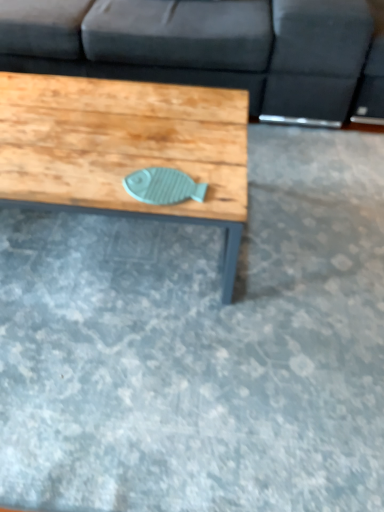
In order to face dark gray fabric couch at upper center, should I rotate leftwards or rightwards?

Rotate left and turn 5.666 degrees.

The height and width of the screenshot is (512, 384). I want to click on dark gray fabric couch at upper center, so click(x=213, y=50).

Measure the distance between point (208, 72) and camera.

Point (208, 72) and camera are 1.80 meters apart from each other.

The width and height of the screenshot is (384, 512). Describe the element at coordinates (213, 50) in the screenshot. I see `dark gray fabric couch at upper center` at that location.

This screenshot has height=512, width=384. What do you see at coordinates (124, 147) in the screenshot?
I see `wooden fish at center` at bounding box center [124, 147].

Locate an element on the screen. The height and width of the screenshot is (512, 384). wooden fish at center is located at coordinates (124, 147).

Image resolution: width=384 pixels, height=512 pixels. I want to click on dark gray fabric couch at upper center, so [213, 50].

Is dark gray fabric couch at upper center at the left side of wooden fish at center?

In fact, dark gray fabric couch at upper center is to the right of wooden fish at center.

Does dark gray fabric couch at upper center come behind wooden fish at center?

That is True.

Between point (373, 106) and point (64, 85), which one is positioned in front?

The point (64, 85) is in front.

From the image's perspective, between dark gray fabric couch at upper center and wooden fish at center, who is located below?

wooden fish at center appears lower in the image.

From a real-world perspective, between dark gray fabric couch at upper center and wooden fish at center, who is vertically higher?

dark gray fabric couch at upper center is physically above.

Looking at this image, considering the relative sizes of dark gray fabric couch at upper center and wooden fish at center in the image provided, is dark gray fabric couch at upper center wider than wooden fish at center?

Yes.

Consider the image. In terms of height, does dark gray fabric couch at upper center look taller or shorter compared to wooden fish at center?

dark gray fabric couch at upper center is taller than wooden fish at center.

Between dark gray fabric couch at upper center and wooden fish at center, which one has smaller size?

With smaller size is wooden fish at center.

Would you say dark gray fabric couch at upper center is inside or outside wooden fish at center?

dark gray fabric couch at upper center is outside wooden fish at center.

Is there a large distance between dark gray fabric couch at upper center and wooden fish at center?

No, there isn't a large distance between dark gray fabric couch at upper center and wooden fish at center.

Is wooden fish at center at the back of dark gray fabric couch at upper center?

No, dark gray fabric couch at upper center is not facing the opposite direction of wooden fish at center.

Can you tell me how much dark gray fabric couch at upper center and wooden fish at center differ in facing direction?

The angle between the facing direction of dark gray fabric couch at upper center and the facing direction of wooden fish at center is 0.827 degrees.

Find the location of a particular element. studio couch located above the wooden fish at center (from the image's perspective) is located at coordinates (213, 50).

Between wooden fish at center and dark gray fabric couch at upper center, which one appears on the right side from the viewer's perspective?

dark gray fabric couch at upper center.

Considering their positions, is wooden fish at center located in front of or behind dark gray fabric couch at upper center?

In the image, wooden fish at center appears in front of dark gray fabric couch at upper center.

Which point is more forward, (179, 104) or (362, 82)?

The point (179, 104) is closer.

From the image's perspective, is wooden fish at center beneath dark gray fabric couch at upper center?

Correct, wooden fish at center appears lower than dark gray fabric couch at upper center in the image.

From a real-world perspective, which is physically below, wooden fish at center or dark gray fabric couch at upper center?

In real-world perspective, wooden fish at center is lower.

Does wooden fish at center have a greater width compared to dark gray fabric couch at upper center?

No.

Considering the relative sizes of wooden fish at center and dark gray fabric couch at upper center in the image provided, is wooden fish at center shorter than dark gray fabric couch at upper center?

Correct, wooden fish at center is not as tall as dark gray fabric couch at upper center.

Based on the photo, considering the sizes of objects wooden fish at center and dark gray fabric couch at upper center in the image provided, who is smaller, wooden fish at center or dark gray fabric couch at upper center?

wooden fish at center is smaller.

Can dark gray fabric couch at upper center be found inside wooden fish at center?

Actually, dark gray fabric couch at upper center is outside wooden fish at center.

Is wooden fish at center next to dark gray fabric couch at upper center and touching it?

wooden fish at center and dark gray fabric couch at upper center are not in contact.

Is wooden fish at center facing away from dark gray fabric couch at upper center?

Correct, wooden fish at center is looking away from dark gray fabric couch at upper center.

How different are the orientations of wooden fish at center and dark gray fabric couch at upper center in degrees?

0.827 degrees separate the facing orientations of wooden fish at center and dark gray fabric couch at upper center.

This screenshot has width=384, height=512. I want to click on coffee table that appears on the left of dark gray fabric couch at upper center, so click(124, 147).

This screenshot has width=384, height=512. What are the coordinates of `coffee table that appears below the dark gray fabric couch at upper center (from the image's perspective)` in the screenshot? It's located at (124, 147).

The height and width of the screenshot is (512, 384). In order to click on studio couch behind the wooden fish at center in this screenshot , I will do click(x=213, y=50).